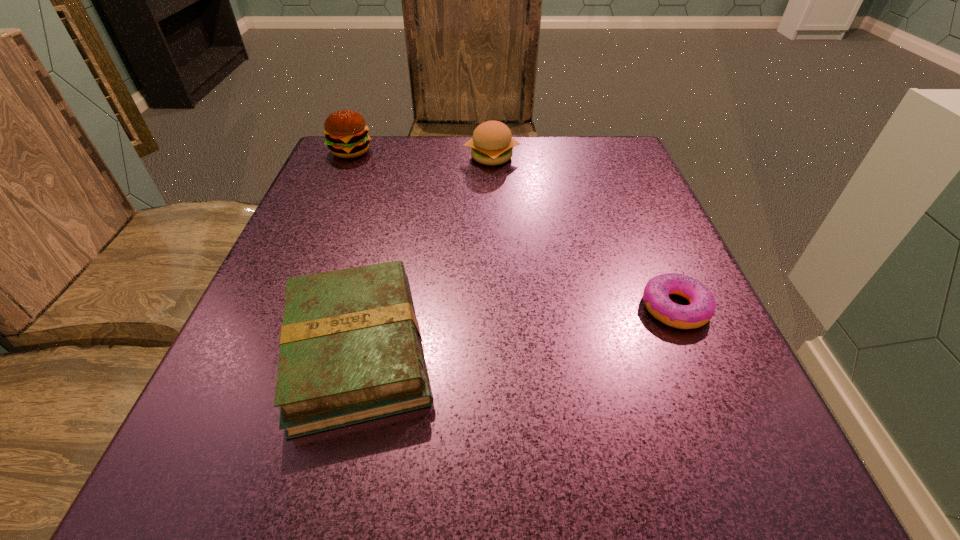
Locate an element on the screen. Image resolution: width=960 pixels, height=540 pixels. the left hamburger is located at coordinates (346, 132).

Where is `the right hamburger`? the right hamburger is located at coordinates (492, 144).

The width and height of the screenshot is (960, 540). In order to click on book in this screenshot , I will do pyautogui.click(x=351, y=351).

Locate an element on the screen. This screenshot has width=960, height=540. the shortest object is located at coordinates (656, 299).

Where is `the rightmost object`? the rightmost object is located at coordinates (656, 299).

This screenshot has height=540, width=960. I want to click on vacant space located 0.360m on the right of the left hamburger, so click(526, 151).

This screenshot has height=540, width=960. I want to click on free space located on the right of the second object from right to left, so click(624, 157).

The width and height of the screenshot is (960, 540). Find the location of `vacant region located 0.180m on the back of the book`. vacant region located 0.180m on the back of the book is located at coordinates (390, 218).

Locate an element on the screen. Image resolution: width=960 pixels, height=540 pixels. free space located on the left of the shortest object is located at coordinates (440, 307).

Locate an element on the screen. This screenshot has width=960, height=540. object at the near edge is located at coordinates (351, 351).